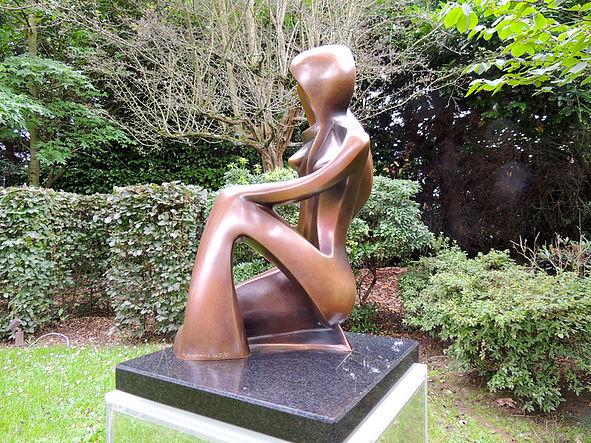
Identify the location of bust of sculpture. The image size is (591, 443). (324, 158).